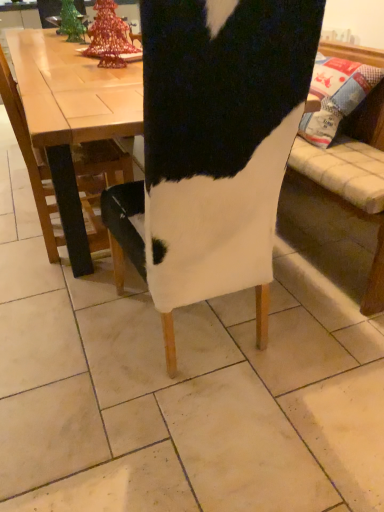
Where is `free location in front of white fabric chair at center, the second chair viewed from the left`? The height and width of the screenshot is (512, 384). free location in front of white fabric chair at center, the second chair viewed from the left is located at coordinates (189, 441).